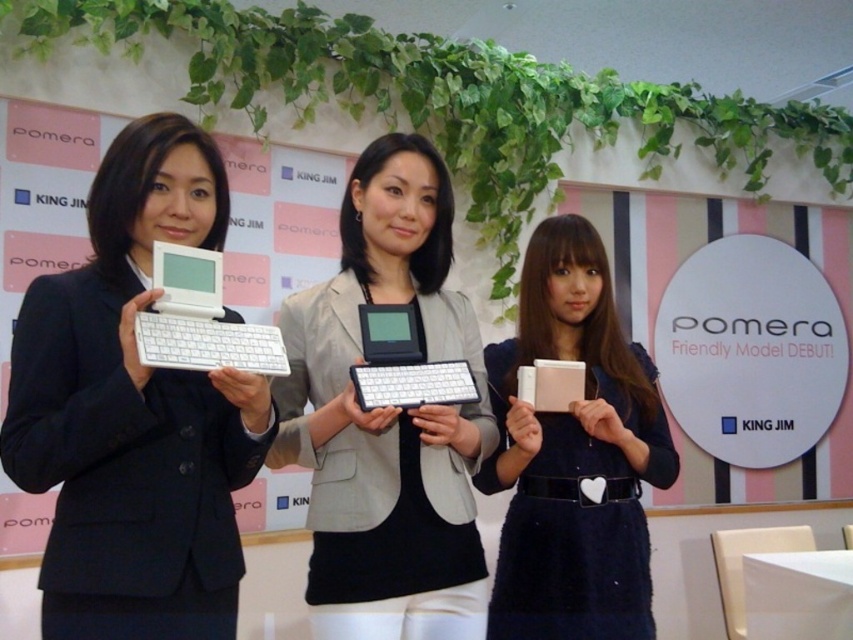
You are attending a product launch event and notice two devices displayed on a table. The white matte laptop at left and the white matte tablet at center are both part of the new product line. Based on their positioning, which device is placed higher up on the table?

The white matte laptop at left is located above the white matte tablet at center, so it is placed higher up on the table.

You are standing in front of the three people at the promotional event. You want to take a photo of both the point at (x=106, y=189) and the point at (x=165, y=316). Which point should you focus on first to ensure both are in focus?

You should focus on the point at (x=106, y=189) first because it is closer to you than the point at (x=165, y=316). By focusing on the closer point, the farther point will also be in focus due to the depth of field.

You are a photographer setting up for a group photo. The subjects are holding a white matte laptop at left and a white matte tablet at center. If you need to ensure there is at least 30 inches between the two devices for proper framing, is the current distance sufficient?

The distance between the white matte laptop at left and the white matte tablet at center is 27.45 inches, which is less than the required 30 inches. Therefore, the current distance is not sufficient for proper framing.